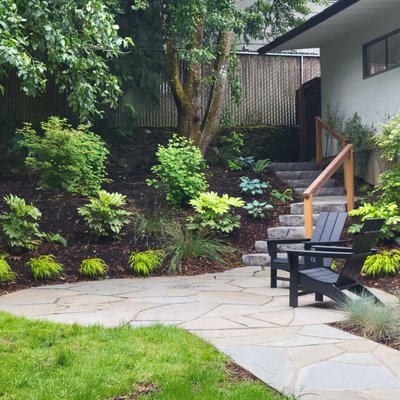
Where is `window`? window is located at coordinates (372, 60), (396, 56).